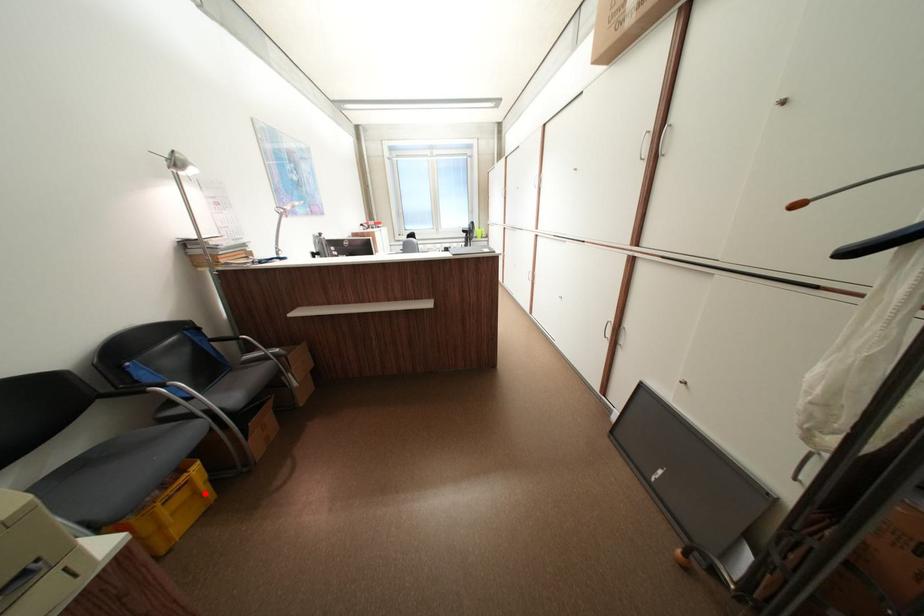
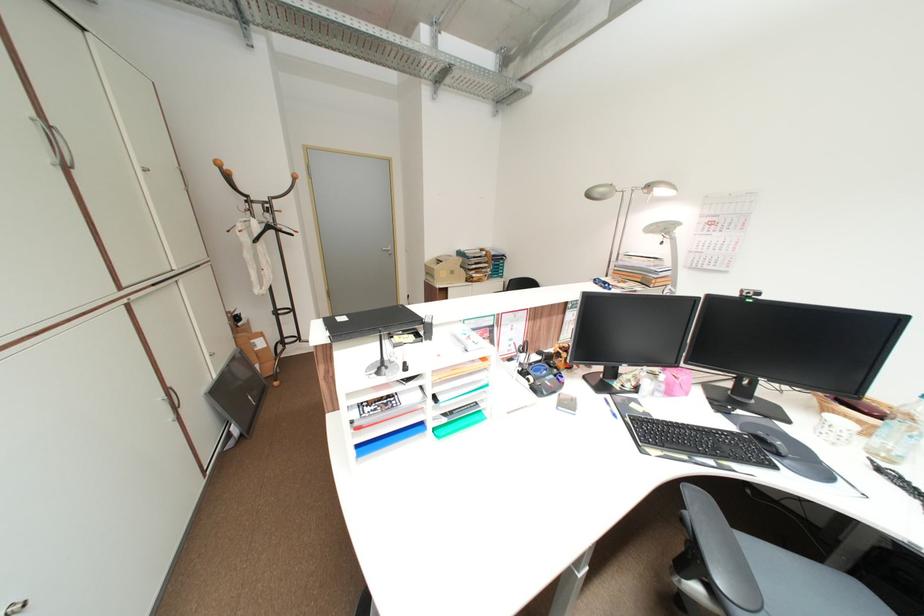
Question: I am providing you with two images of the same scene from different viewpoints. A red point is marked on the first image. Is the red point's position out of view in image 2?

Choices:
 (A) Yes
 (B) No

Answer: (A)